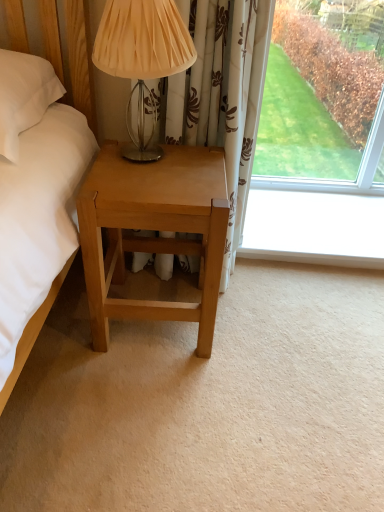
In order to click on free spot below matte beige fabric at upper center (from a real-world perspective) in this screenshot , I will do 136,156.